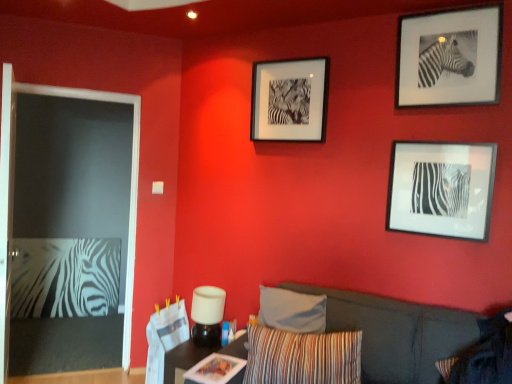
At what (x,y) coordinates should I click in order to perform the action: click on free region under black matte picture frame at upper right, arranged as the first picture frame when viewed from the right (from a real-world perspective). Please return your answer as a coordinate pair (x, y). Looking at the image, I should click on [x=442, y=138].